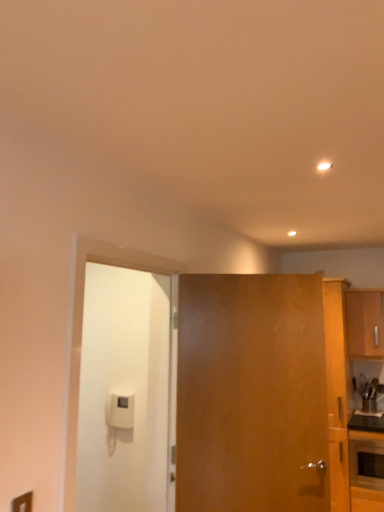
Question: Can you confirm if wooden cabinet at right is positioned to the right of wooden door at center, which is the first door in right-to-left order?

Choices:
 (A) no
 (B) yes

Answer: (B)

Question: Could you tell me if wooden cabinet at right is turned towards wooden door at center, which is the first door in right-to-left order?

Choices:
 (A) yes
 (B) no

Answer: (A)

Question: Is wooden cabinet at right further to camera compared to wooden door at center, which is the first door in right-to-left order?

Choices:
 (A) yes
 (B) no

Answer: (A)

Question: Considering the relative sizes of wooden cabinet at right and wooden door at center, which is the first door in right-to-left order, in the image provided, is wooden cabinet at right wider than wooden door at center, which is the first door in right-to-left order,?

Choices:
 (A) no
 (B) yes

Answer: (B)

Question: From the image's perspective, is wooden cabinet at right under wooden door at center, which is the first door in right-to-left order?

Choices:
 (A) no
 (B) yes

Answer: (A)

Question: Considering the relative sizes of wooden cabinet at right and wooden door at center, which is the first door in right-to-left order, in the image provided, is wooden cabinet at right shorter than wooden door at center, which is the first door in right-to-left order,?

Choices:
 (A) no
 (B) yes

Answer: (B)

Question: From a real-world perspective, is wooden cabinet at right positioned over white matte door at left, the 2th door when ordered from right to left, based on gravity?

Choices:
 (A) yes
 (B) no

Answer: (A)

Question: From the image's perspective, is wooden cabinet at right located beneath white matte door at left, the 2th door when ordered from right to left?

Choices:
 (A) yes
 (B) no

Answer: (B)

Question: Is wooden cabinet at right beside white matte door at left, the 2th door when ordered from right to left?

Choices:
 (A) yes
 (B) no

Answer: (B)

Question: Would you say wooden cabinet at right is a long distance from white matte door at left, the 1th door in the left-to-right sequence?

Choices:
 (A) no
 (B) yes

Answer: (B)

Question: From a real-world perspective, is wooden cabinet at right physically below white matte door at left, the 2th door when ordered from right to left?

Choices:
 (A) no
 (B) yes

Answer: (A)

Question: Is wooden cabinet at right located outside white matte door at left, the 1th door in the left-to-right sequence?

Choices:
 (A) yes
 (B) no

Answer: (A)

Question: Is wooden door at center, the 2th door from the left, far from matte black oven at lower right?

Choices:
 (A) yes
 (B) no

Answer: (A)